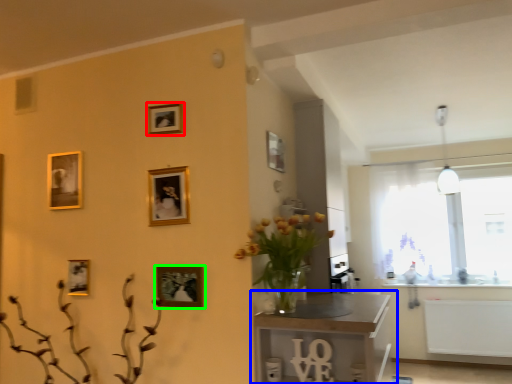
Question: Which object is positioned closest to picture frame (highlighted by a red box)? Select from table (highlighted by a blue box) and picture frame (highlighted by a green box).

Choices:
 (A) table
 (B) picture frame

Answer: (B)